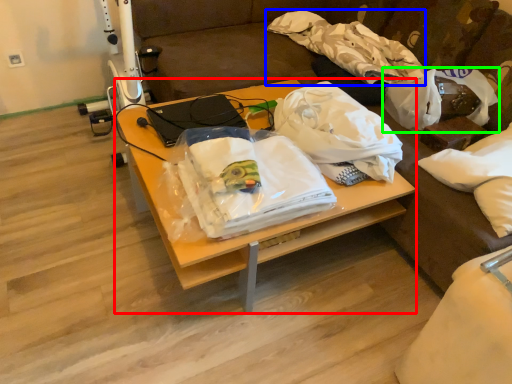
Question: Estimate the real-world distances between objects in this image. Which object is farther from desk (highlighted by a red box), cloth (highlighted by a blue box) or plastic bag (highlighted by a green box)?

Choices:
 (A) cloth
 (B) plastic bag

Answer: (A)